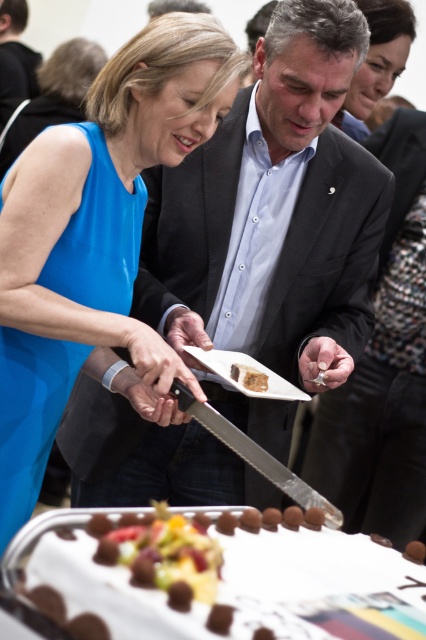
You are a photographer at the event and need to capture a clear photo of both the matte black suit at center and the blue silk dress at upper left. Which one should you focus on first to ensure both are in focus?

You should focus on the matte black suit at center first since it is closer to you than the blue silk dress at upper left, ensuring both will be in focus when focusing on the closer object first.

You are a photographer at the event and want to capture a closeup shot of the blue silk dress at upper left and the silver metallic knife at center. The camera you are using has a maximum focus range of 14 inches. Will you be able to focus on both subjects simultaneously?

The blue silk dress at upper left and the silver metallic knife at center are 13.94 inches apart from each other, which is within the camera maximum focus range of 14 inches. Therefore, the photographer can focus on both subjects simultaneously.